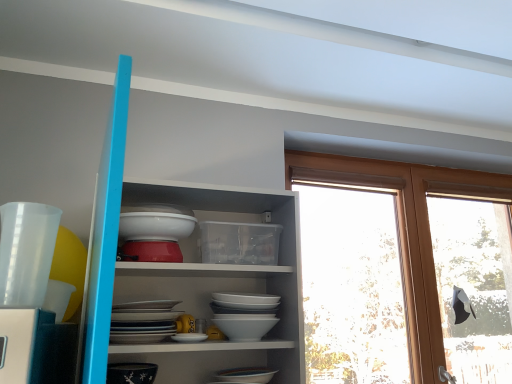
Question: Can you confirm if transparent plastic cup at left, the 2th tableware when ordered from back to front, is bigger than white glossy shelves at upper center?

Choices:
 (A) yes
 (B) no

Answer: (B)

Question: Considering the relative positions of transparent plastic cup at left, the second tableware from the bottom, and white glossy shelves at upper center in the image provided, is transparent plastic cup at left, the second tableware from the bottom, to the left of white glossy shelves at upper center from the viewer's perspective?

Choices:
 (A) yes
 (B) no

Answer: (A)

Question: Is white glossy shelves at upper center located within transparent plastic cup at left, which is the first tableware in front-to-back order?

Choices:
 (A) no
 (B) yes

Answer: (A)

Question: Considering the relative positions of transparent plastic cup at left, the second tableware from the bottom, and white glossy shelves at upper center in the image provided, is transparent plastic cup at left, the second tableware from the bottom, to the right of white glossy shelves at upper center from the viewer's perspective?

Choices:
 (A) yes
 (B) no

Answer: (B)

Question: Is transparent plastic cup at left, which ranks as the first tableware in top-to-bottom order, in contact with white glossy shelves at upper center?

Choices:
 (A) yes
 (B) no

Answer: (B)

Question: From the image's perspective, is transparent plastic cup at left, the 2th tableware when ordered from back to front, located above white glossy shelves at upper center?

Choices:
 (A) yes
 (B) no

Answer: (A)

Question: From a real-world perspective, is white glossy shelves at upper center over transparent plastic cup at left, which ranks as the first tableware in top-to-bottom order?

Choices:
 (A) yes
 (B) no

Answer: (B)

Question: Does white glossy shelves at upper center appear on the left side of transparent plastic cup at left, the second tableware from the bottom?

Choices:
 (A) yes
 (B) no

Answer: (B)

Question: Does white glossy shelves at upper center lie in front of transparent plastic cup at left, the 2th tableware when ordered from back to front?

Choices:
 (A) yes
 (B) no

Answer: (A)

Question: Are white glossy shelves at upper center and transparent plastic cup at left, the second tableware from the bottom, making contact?

Choices:
 (A) no
 (B) yes

Answer: (A)

Question: Is white glossy shelves at upper center smaller than transparent plastic cup at left, the 2th tableware when ordered from back to front?

Choices:
 (A) yes
 (B) no

Answer: (B)

Question: Considering the relative sizes of white glossy shelves at upper center and transparent plastic cup at left, the second tableware from the bottom, in the image provided, is white glossy shelves at upper center shorter than transparent plastic cup at left, the second tableware from the bottom,?

Choices:
 (A) yes
 (B) no

Answer: (B)

Question: Is white glossy shelves at upper center inside black glossy bowl at lower left, placed as the first tableware when sorted from back to front?

Choices:
 (A) no
 (B) yes

Answer: (A)